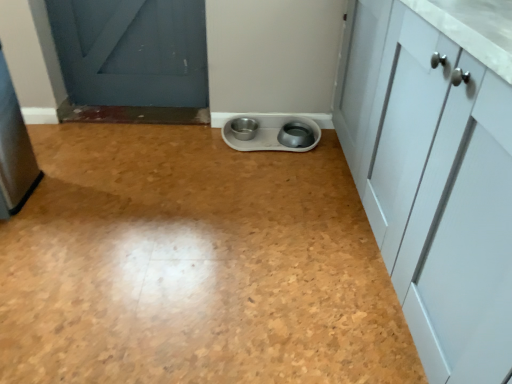
The width and height of the screenshot is (512, 384). What are the coordinates of `brushed metal refrigerator at left, marked as the first appliance in a left-to-right arrangement` in the screenshot? It's located at (14, 151).

At what (x,y) coordinates should I click in order to perform the action: click on brushed metal refrigerator at left, the 2th appliance when ordered from back to front. Please return your answer as a coordinate pair (x, y). The image size is (512, 384). Looking at the image, I should click on [14, 151].

Is white plastic pet bowls at center further to camera compared to brushed metal refrigerator at left, marked as the second appliance in a right-to-left arrangement?

No, it is not.

Considering the sizes of objects white plastic pet bowls at center and brushed metal refrigerator at left, marked as the first appliance in a left-to-right arrangement, in the image provided, who is bigger, white plastic pet bowls at center or brushed metal refrigerator at left, marked as the first appliance in a left-to-right arrangement,?

white plastic pet bowls at center is bigger.

The height and width of the screenshot is (384, 512). Find the location of `appliance on the left of the white plastic pet bowls at center`. appliance on the left of the white plastic pet bowls at center is located at coordinates (14, 151).

Which object is wider, white plastic pet bowls at center or brushed metal refrigerator at left, marked as the second appliance in a right-to-left arrangement?

Wider between the two is white plastic pet bowls at center.

Does white plastic pet bowls at center turn towards metallic gray bowls at center, arranged as the first appliance when viewed from the back?

No, white plastic pet bowls at center is not turned towards metallic gray bowls at center, arranged as the first appliance when viewed from the back.

How many degrees apart are the facing directions of white plastic pet bowls at center and metallic gray bowls at center, arranged as the first appliance when viewed from the back?

There is a 88.9-degree angle between the facing directions of white plastic pet bowls at center and metallic gray bowls at center, arranged as the first appliance when viewed from the back.

Does point (349, 176) appear closer or farther from the camera than point (269, 128)?

Point (349, 176) is closer to the camera than point (269, 128).

Would you say white plastic pet bowls at center contains metallic gray bowls at center, acting as the 1th appliance starting from the right?

No, metallic gray bowls at center, acting as the 1th appliance starting from the right, is not a part of white plastic pet bowls at center.

Does point (268, 139) come in front of point (280, 310)?

No, it is behind (280, 310).

From a real-world perspective, is metallic gray bowls at center, positioned as the 2th appliance in front-to-back order, physically below white plastic pet bowls at center?

Actually, metallic gray bowls at center, positioned as the 2th appliance in front-to-back order, is physically above white plastic pet bowls at center in the real world.

Between metallic gray bowls at center, the second appliance in the left-to-right sequence, and white plastic pet bowls at center, which one appears on the left side from the viewer's perspective?

From the viewer's perspective, white plastic pet bowls at center appears more on the left side.

From a real-world perspective, is brushed metal refrigerator at left, the 2th appliance when ordered from back to front, physically located above or below metallic gray bowls at center, positioned as the 2th appliance in front-to-back order?

From a real-world perspective, brushed metal refrigerator at left, the 2th appliance when ordered from back to front, is physically above metallic gray bowls at center, positioned as the 2th appliance in front-to-back order.

Is brushed metal refrigerator at left, marked as the second appliance in a right-to-left arrangement, thinner than metallic gray bowls at center, arranged as the first appliance when viewed from the back?

No.

Is brushed metal refrigerator at left, positioned as the 1th appliance in front-to-back order, located outside metallic gray bowls at center, arranged as the first appliance when viewed from the back?

Indeed, brushed metal refrigerator at left, positioned as the 1th appliance in front-to-back order, is completely outside metallic gray bowls at center, arranged as the first appliance when viewed from the back.

Does brushed metal refrigerator at left, marked as the second appliance in a right-to-left arrangement, touch metallic gray bowls at center, positioned as the 2th appliance in front-to-back order?

brushed metal refrigerator at left, marked as the second appliance in a right-to-left arrangement, is not next to metallic gray bowls at center, positioned as the 2th appliance in front-to-back order, and they're not touching.

How different are the orientations of metallic gray bowls at center, the second appliance in the left-to-right sequence, and brushed metal refrigerator at left, marked as the second appliance in a right-to-left arrangement, in degrees?

179 degrees.

Which of these two, metallic gray bowls at center, arranged as the first appliance when viewed from the back, or brushed metal refrigerator at left, marked as the second appliance in a right-to-left arrangement, is wider?

With larger width is brushed metal refrigerator at left, marked as the second appliance in a right-to-left arrangement.

Looking at this image, is metallic gray bowls at center, positioned as the 2th appliance in front-to-back order, completely or partially outside of brushed metal refrigerator at left, marked as the second appliance in a right-to-left arrangement?

Absolutely, metallic gray bowls at center, positioned as the 2th appliance in front-to-back order, is external to brushed metal refrigerator at left, marked as the second appliance in a right-to-left arrangement.

Does metallic gray bowls at center, arranged as the first appliance when viewed from the back, lie behind brushed metal refrigerator at left, marked as the first appliance in a left-to-right arrangement?

Yes, it is.

Is white plastic pet bowls at center at the back of brushed metal refrigerator at left, marked as the second appliance in a right-to-left arrangement?

No, white plastic pet bowls at center is not at the back of brushed metal refrigerator at left, marked as the second appliance in a right-to-left arrangement.

Can you confirm if brushed metal refrigerator at left, marked as the second appliance in a right-to-left arrangement, is taller than white plastic pet bowls at center?

Indeed, brushed metal refrigerator at left, marked as the second appliance in a right-to-left arrangement, has a greater height compared to white plastic pet bowls at center.

Looking at this image, does brushed metal refrigerator at left, marked as the first appliance in a left-to-right arrangement, have a greater width compared to white plastic pet bowls at center?

No, brushed metal refrigerator at left, marked as the first appliance in a left-to-right arrangement, is not wider than white plastic pet bowls at center.

This screenshot has height=384, width=512. What are the coordinates of `the 1st appliance behind the white plastic pet bowls at center, counting from the anchor's position` in the screenshot? It's located at (14, 151).

At what (x,y) coordinates should I click in order to perform the action: click on appliance that is the 2nd object above the white plastic pet bowls at center (from a real-world perspective). Please return your answer as a coordinate pair (x, y). Image resolution: width=512 pixels, height=384 pixels. Looking at the image, I should click on (14, 151).

Where is `appliance that is the 2nd one when counting backward from the white plastic pet bowls at center`? This screenshot has width=512, height=384. appliance that is the 2nd one when counting backward from the white plastic pet bowls at center is located at coordinates [268, 134].

Which object lies further to the anchor point white plastic pet bowls at center, brushed metal refrigerator at left, positioned as the 1th appliance in front-to-back order, or metallic gray bowls at center, acting as the 1th appliance starting from the right?

The object further to white plastic pet bowls at center is metallic gray bowls at center, acting as the 1th appliance starting from the right.

From the image, which object appears to be farther from metallic gray bowls at center, acting as the 1th appliance starting from the right, white plastic pet bowls at center or brushed metal refrigerator at left, marked as the first appliance in a left-to-right arrangement?

Based on the image, brushed metal refrigerator at left, marked as the first appliance in a left-to-right arrangement, appears to be further to metallic gray bowls at center, acting as the 1th appliance starting from the right.

Considering their positions, is metallic gray bowls at center, arranged as the first appliance when viewed from the back, positioned closer to white plastic pet bowls at center than brushed metal refrigerator at left, marked as the second appliance in a right-to-left arrangement?

brushed metal refrigerator at left, marked as the second appliance in a right-to-left arrangement, is closer to white plastic pet bowls at center.

Based on their spatial positions, is white plastic pet bowls at center or metallic gray bowls at center, arranged as the first appliance when viewed from the back, closer to brushed metal refrigerator at left, marked as the second appliance in a right-to-left arrangement?

The object closer to brushed metal refrigerator at left, marked as the second appliance in a right-to-left arrangement, is white plastic pet bowls at center.

When comparing their distances from metallic gray bowls at center, the second appliance in the left-to-right sequence, does brushed metal refrigerator at left, the 2th appliance when ordered from back to front, or white plastic pet bowls at center seem closer?

white plastic pet bowls at center lies closer to metallic gray bowls at center, the second appliance in the left-to-right sequence, than the other object.

From the image, which object appears to be nearer to brushed metal refrigerator at left, the 2th appliance when ordered from back to front, metallic gray bowls at center, arranged as the first appliance when viewed from the back, or white plastic pet bowls at center?

The object closer to brushed metal refrigerator at left, the 2th appliance when ordered from back to front, is white plastic pet bowls at center.

This screenshot has height=384, width=512. What are the coordinates of `plain located between brushed metal refrigerator at left, marked as the second appliance in a right-to-left arrangement, and metallic gray bowls at center, arranged as the first appliance when viewed from the back, in the left-right direction` in the screenshot? It's located at (194, 266).